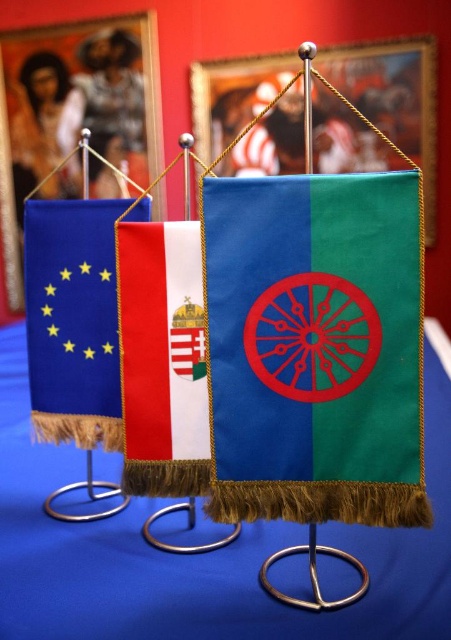
You are an interior designer arranging flags in a gallery. You have a green fabric flag at center and a red velvet flag at center. Which flag should you place higher on the wall to maintain visual balance?

The green fabric flag at center is taller than the red velvet flag at center, so to maintain visual balance, place the shorter red velvet flag at center higher on the wall to compensate for its smaller size.

You are standing in front of a wall with two flags displayed. The flags are the green fabric flag at center and the red velvet flag at center. According to their positions, which flag is positioned to the right?

The green fabric flag at center is positioned to the right of the red velvet flag at center.

You are an interior designer arranging a gallery wall. You have a green velvet flag at center and a brushed metal picture frame at upper left. Which object should you place higher to ensure they align properly with the wall decor?

The green velvet flag at center is shorter than the brushed metal picture frame at upper left, so you should place the green velvet flag at center higher to align their tops or the brushed metal picture frame at upper left lower to match the height of the shorter flag.